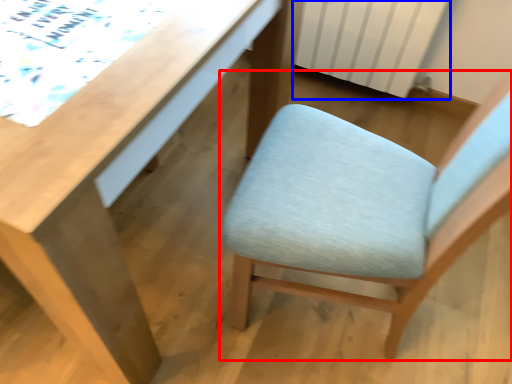
Question: Which object is further to the camera taking this photo, chair (highlighted by a red box) or radiator (highlighted by a blue box)?

Choices:
 (A) chair
 (B) radiator

Answer: (B)